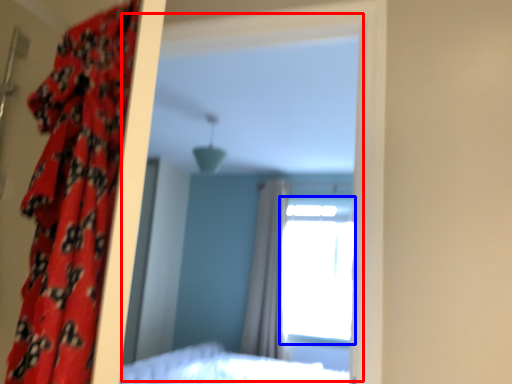
Question: Which object appears farthest to the camera in this image, mirror (highlighted by a red box) or window (highlighted by a blue box)?

Choices:
 (A) mirror
 (B) window

Answer: (B)